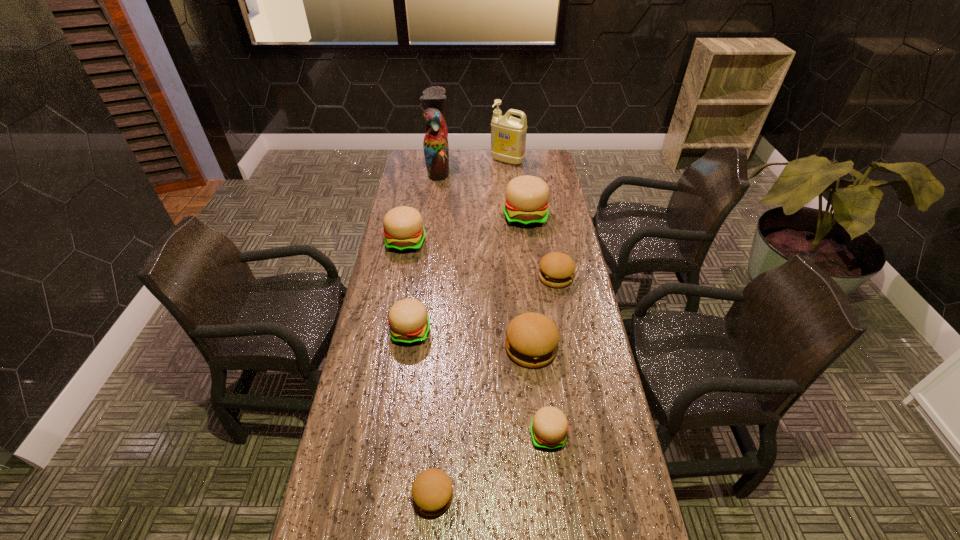
You are a GUI agent. You are given a task and a screenshot of the screen. Output one action in this format:
    pyautogui.click(x=<x>, y=<y>)
    Task: Click on the vacant point at the left edge
    The height and width of the screenshot is (540, 960).
    Given the screenshot: What is the action you would take?
    pyautogui.click(x=359, y=476)

Image resolution: width=960 pixels, height=540 pixels. In the image, there is a desktop. What are the coordinates of `vacant space at the right edge` in the screenshot? It's located at (624, 484).

In the image, there is a desktop. Where is `vacant space at the far right corner`? vacant space at the far right corner is located at coordinates (530, 173).

The image size is (960, 540). Find the location of `empty space that is in between the fourth tallest object and the biggest brown hamburger`. empty space that is in between the fourth tallest object and the biggest brown hamburger is located at coordinates (468, 295).

Locate an element on the screen. empty space between the sixth shortest hamburger and the biggest brown hamburger is located at coordinates (468, 295).

Where is `free area in between the nearest beige hamburger and the nearest hamburger`? free area in between the nearest beige hamburger and the nearest hamburger is located at coordinates (491, 465).

This screenshot has width=960, height=540. I want to click on free space between the biggest brown hamburger and the detergent, so click(519, 254).

Find the location of `free space between the shortest hamburger and the biggest brown hamburger`. free space between the shortest hamburger and the biggest brown hamburger is located at coordinates click(x=482, y=422).

This screenshot has width=960, height=540. I want to click on free space between the tallest object and the eighth shortest object, so click(472, 164).

Locate an element on the screen. The image size is (960, 540). free space between the second biggest beige hamburger and the fifth farthest object is located at coordinates (481, 260).